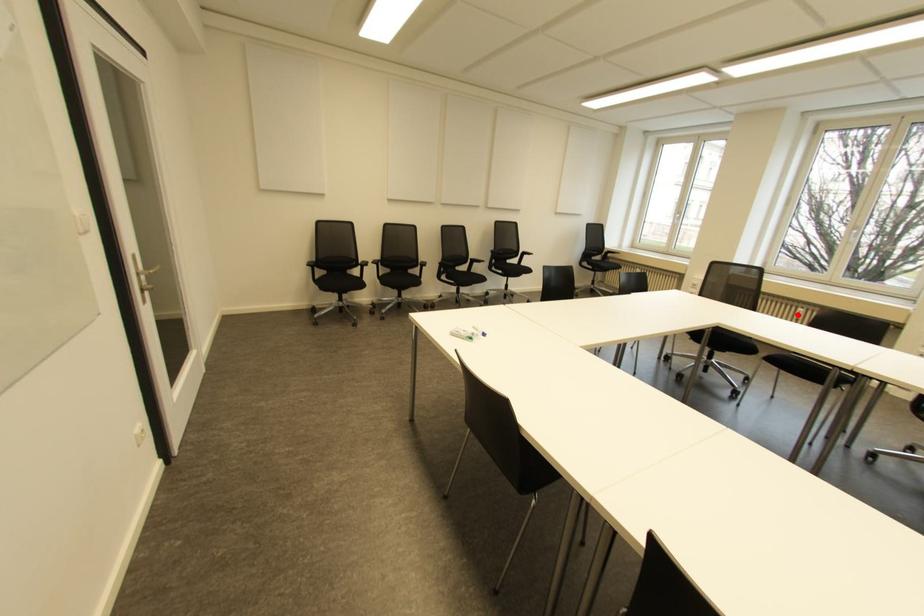
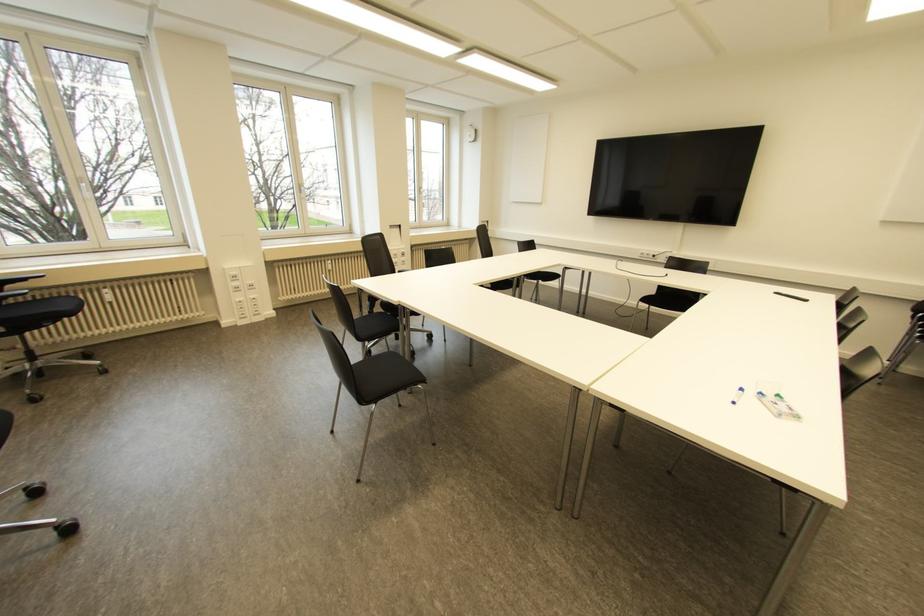
Question: I am providing you with two images of the same scene from different viewpoints. Image1 has a red point marked. In image2, the corresponding 3D location appears at what relative position? Reply with the corresponding letter.

Choices:
 (A) Closer
 (B) Farther

Answer: (B)